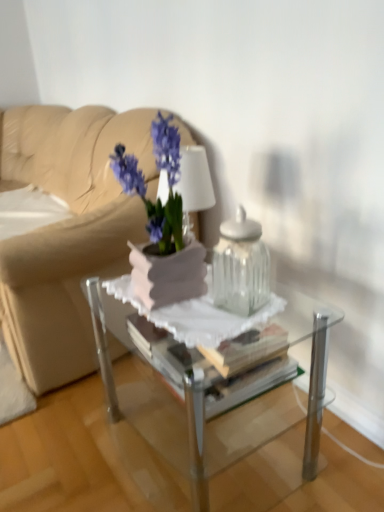
Question: From a real-world perspective, is beige leather couch at upper left above or below clear glass jar at center?

Choices:
 (A) below
 (B) above

Answer: (A)

Question: From the image's perspective, is beige leather couch at upper left above or below clear glass jar at center?

Choices:
 (A) below
 (B) above

Answer: (B)

Question: Which object is the closest to the clear glass jar at center?

Choices:
 (A) matte white vase at center
 (B) clear glass table at center
 (C) beige leather couch at upper left

Answer: (A)

Question: Based on their relative distances, which object is nearer to the matte white vase at center?

Choices:
 (A) beige leather couch at upper left
 (B) clear glass table at center
 (C) clear glass jar at center

Answer: (C)